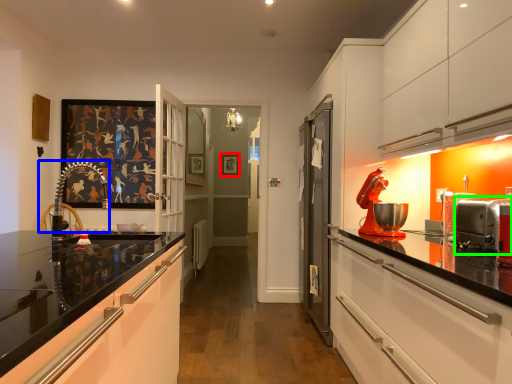
Question: Based on their relative distances, which object is farther from picture frame (highlighted by a red box)? Choose from chair (highlighted by a blue box) and appliance (highlighted by a green box).

Choices:
 (A) chair
 (B) appliance

Answer: (B)